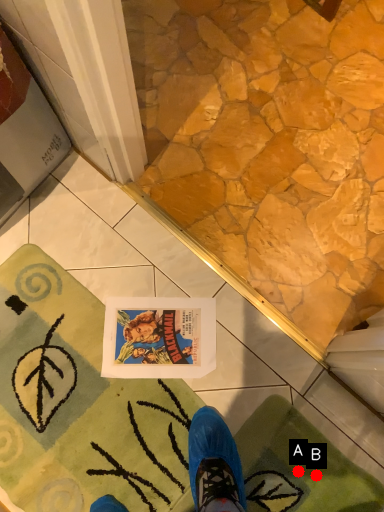
Question: Two points are circled on the image, labeled by A and B beside each circle. Which point is farther to the camera?

Choices:
 (A) A is further
 (B) B is further

Answer: (B)